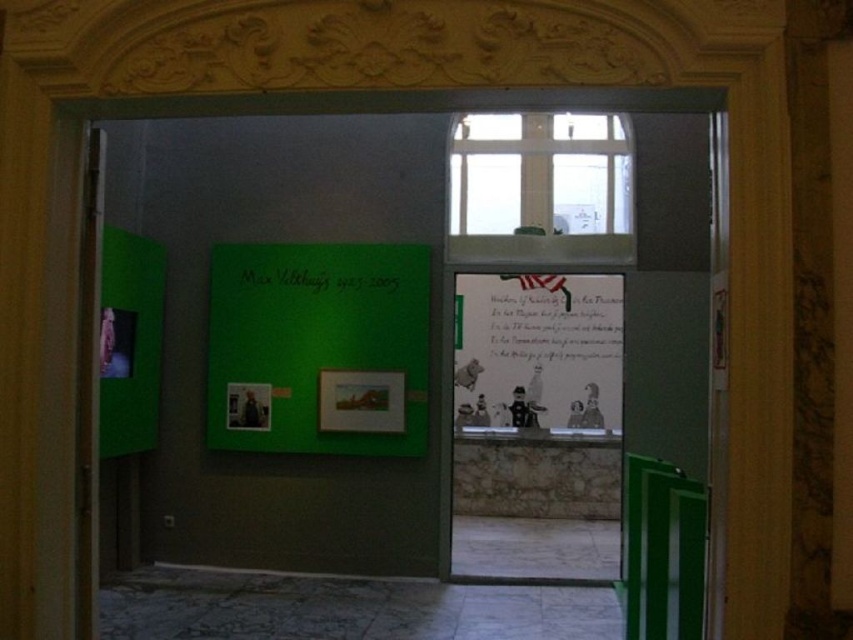
Question: Which point appears farthest from the camera in this image?

Choices:
 (A) (521, 416)
 (B) (605, 289)
 (C) (699, 492)
 (D) (392, 289)

Answer: (B)

Question: Is the position of green glossy door at right more distant than that of green matte sign at center?

Choices:
 (A) no
 (B) yes

Answer: (A)

Question: Considering the relative positions of matte paper poster at center and green glossy door at right in the image provided, where is matte paper poster at center located with respect to green glossy door at right?

Choices:
 (A) left
 (B) right

Answer: (B)

Question: Which object is the closest to the matte paper poster at center?

Choices:
 (A) green matte sign at center
 (B) green glossy door at right

Answer: (A)

Question: In this image, where is matte paper poster at center located relative to green glossy door at right?

Choices:
 (A) above
 (B) below

Answer: (A)

Question: Among these points, which one is nearest to the camera?

Choices:
 (A) (650, 472)
 (B) (610, 275)

Answer: (A)